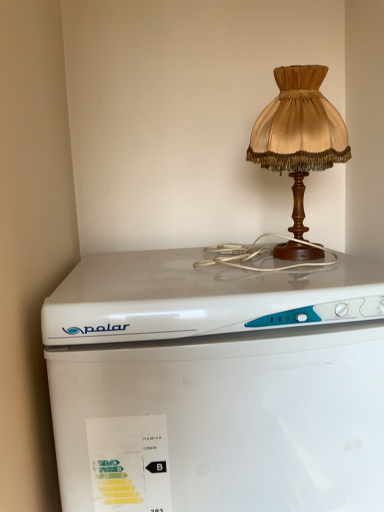
Where is `vacant area that is in front of satin gold lampshade at upper right`? This screenshot has width=384, height=512. vacant area that is in front of satin gold lampshade at upper right is located at coordinates (317, 274).